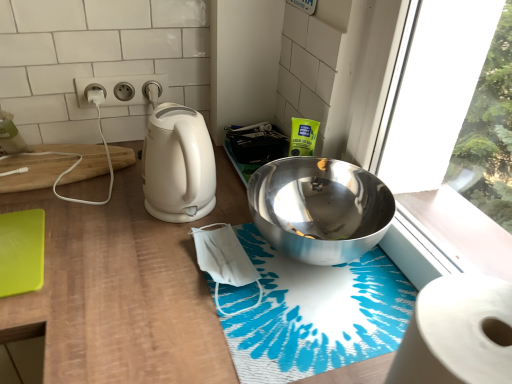
Question: Can you confirm if wooden at left is positioned to the left of white matte toilet paper at left?

Choices:
 (A) no
 (B) yes

Answer: (A)

Question: Does wooden at left come behind white matte toilet paper at left?

Choices:
 (A) no
 (B) yes

Answer: (A)

Question: Is wooden at left in front of white matte toilet paper at left?

Choices:
 (A) yes
 (B) no

Answer: (A)

Question: From a real-world perspective, is wooden at left located beneath white matte toilet paper at left?

Choices:
 (A) yes
 (B) no

Answer: (A)

Question: Considering the relative sizes of wooden at left and white matte toilet paper at left in the image provided, is wooden at left smaller than white matte toilet paper at left?

Choices:
 (A) no
 (B) yes

Answer: (A)

Question: From the image's perspective, is wooden at left beneath white matte toilet paper at left?

Choices:
 (A) no
 (B) yes

Answer: (B)

Question: From the image's perspective, is green matte cutting board at lower left, which is the 1th cutting board in front-to-back order, above white paper at lower right?

Choices:
 (A) no
 (B) yes

Answer: (B)

Question: Is green matte cutting board at lower left, which is the 1th cutting board in front-to-back order, wider than white paper at lower right?

Choices:
 (A) yes
 (B) no

Answer: (A)

Question: From a real-world perspective, is green matte cutting board at lower left, which is the 1th cutting board in front-to-back order, located higher than white paper at lower right?

Choices:
 (A) yes
 (B) no

Answer: (B)

Question: Considering the relative positions of green matte cutting board at lower left, the 2th cutting board positioned from the back, and white paper at lower right in the image provided, is green matte cutting board at lower left, the 2th cutting board positioned from the back, to the left of white paper at lower right from the viewer's perspective?

Choices:
 (A) yes
 (B) no

Answer: (A)

Question: Are green matte cutting board at lower left, which is the 1th cutting board in front-to-back order, and white paper at lower right making contact?

Choices:
 (A) no
 (B) yes

Answer: (A)

Question: Would you say white paper at lower right is part of green matte cutting board at lower left, which is counted as the 1th cutting board, starting from the bottom,'s contents?

Choices:
 (A) yes
 (B) no

Answer: (B)

Question: Does white glossy electric kettle at left have a greater height compared to blue printed bath mat at center?

Choices:
 (A) yes
 (B) no

Answer: (A)